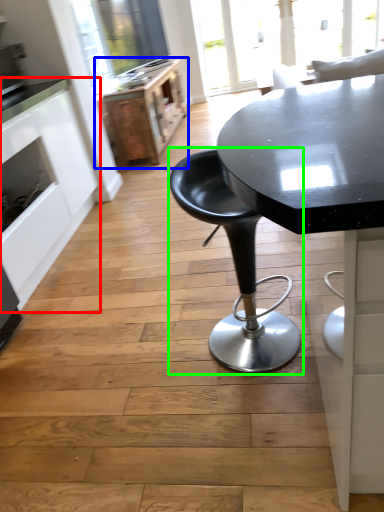
Question: Which object is the closest to the cabinetry (highlighted by a red box)? Choose among these: file cabinet (highlighted by a blue box) or chair (highlighted by a green box).

Choices:
 (A) file cabinet
 (B) chair

Answer: (B)